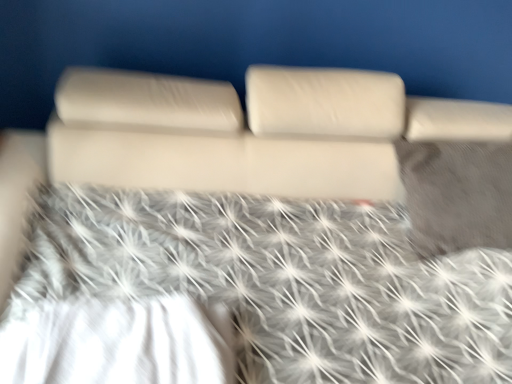
This screenshot has width=512, height=384. In order to click on satin fabric pillow at right in this screenshot , I will do `click(457, 195)`.

Describe the element at coordinates (457, 195) in the screenshot. I see `satin fabric pillow at right` at that location.

Measure the distance between satin fabric pillow at right and camera.

satin fabric pillow at right is 1.37 meters away from camera.

Identify the location of satin fabric pillow at right. (457, 195).